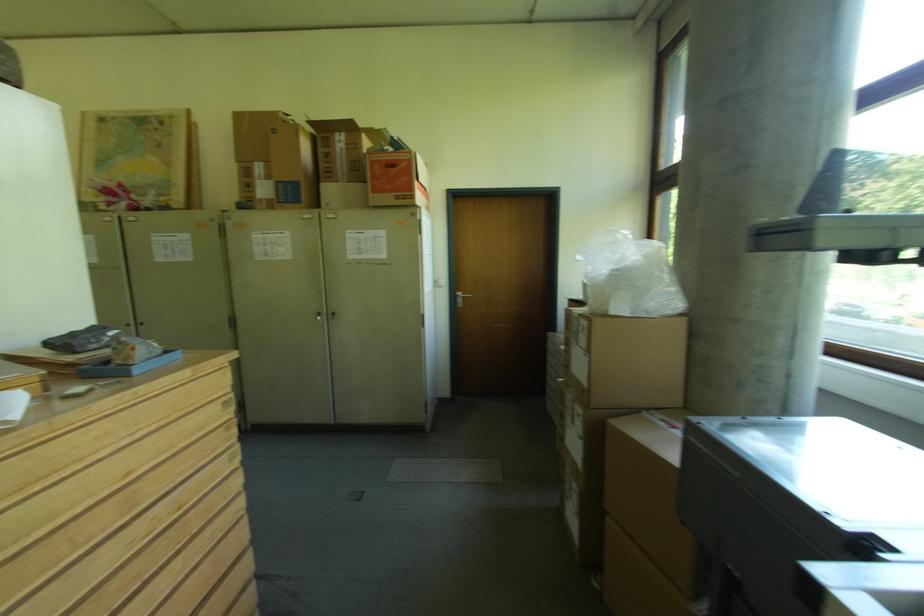
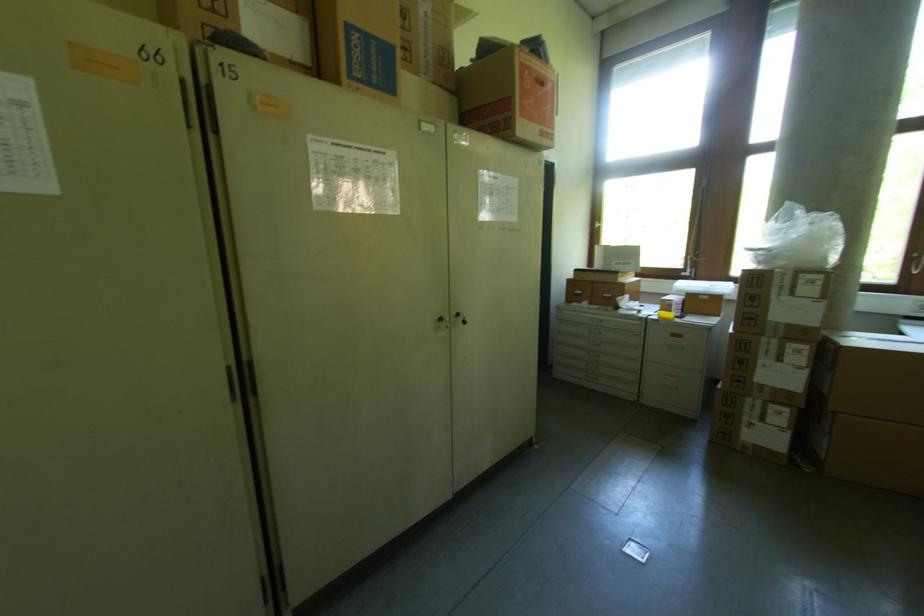
Where in the second image is the point corresponding to the point at 399,200 from the first image?

(543, 136)